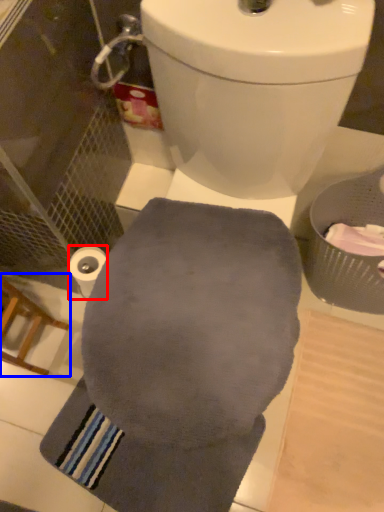
Question: Among these objects, which one is nearest to the camera, toilet paper (highlighted by a red box) or chair (highlighted by a blue box)?

Choices:
 (A) toilet paper
 (B) chair

Answer: (B)